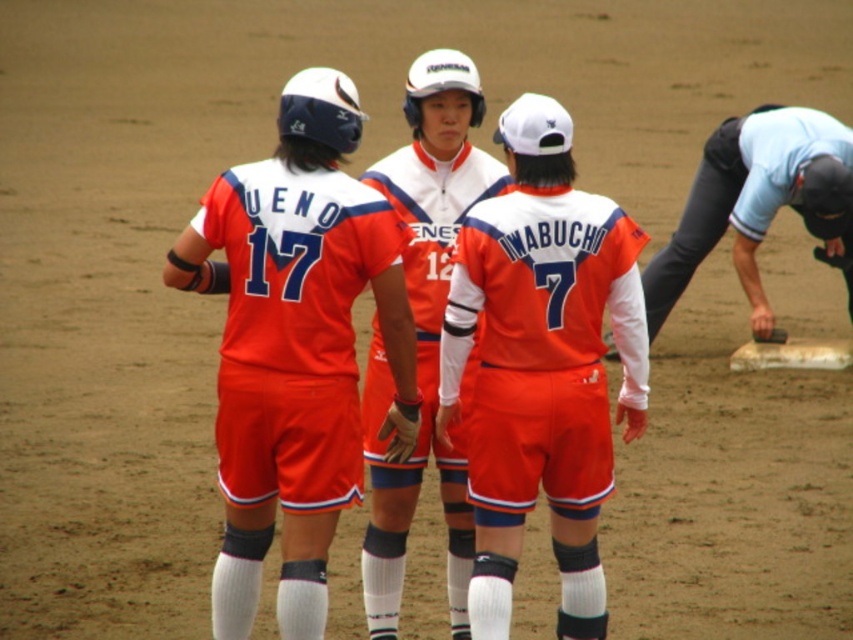
Question: From the image, what is the correct spatial relationship of orange jersey at center in relation to light blue shirt at right?

Choices:
 (A) left
 (B) right

Answer: (A)

Question: Can you confirm if orange fabric jersey at center is positioned to the left of orange jersey at center?

Choices:
 (A) no
 (B) yes

Answer: (B)

Question: Can you confirm if orange fabric jersey at center is positioned to the left of orange jersey at center?

Choices:
 (A) yes
 (B) no

Answer: (A)

Question: Which object is the farthest from the orange fabric jersey at center?

Choices:
 (A) light blue shirt at right
 (B) orange uniformed players at center

Answer: (A)

Question: Based on their relative distances, which object is nearer to the orange matte jersey at center?

Choices:
 (A) orange jersey at center
 (B) orange uniformed players at center
 (C) orange fabric jersey at center
 (D) light blue shirt at right

Answer: (B)

Question: Which point is farther to the camera?

Choices:
 (A) light blue shirt at right
 (B) orange uniformed players at center
 (C) orange jersey at center
 (D) orange fabric jersey at center

Answer: (A)